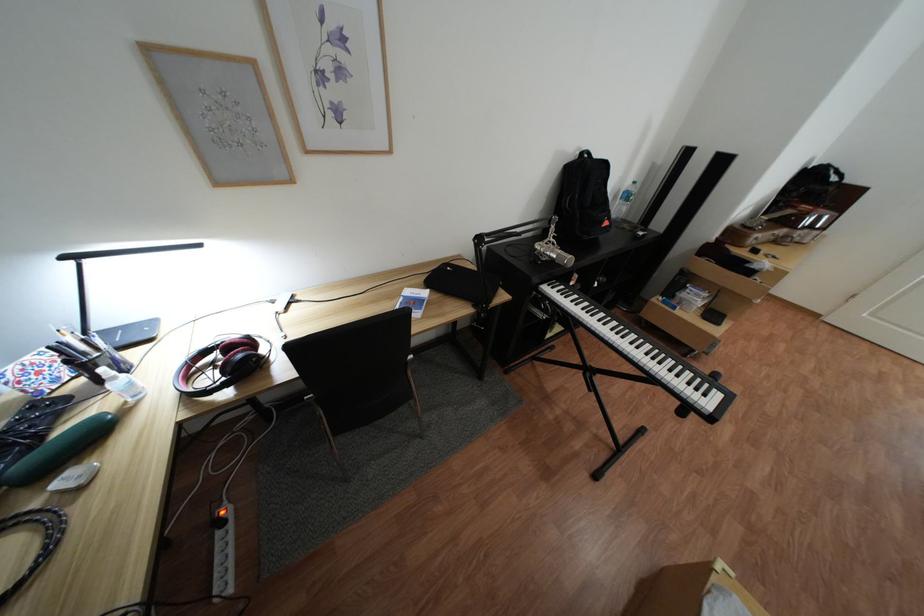
The width and height of the screenshot is (924, 616). Identify the location of keyboard keys. (643, 353).